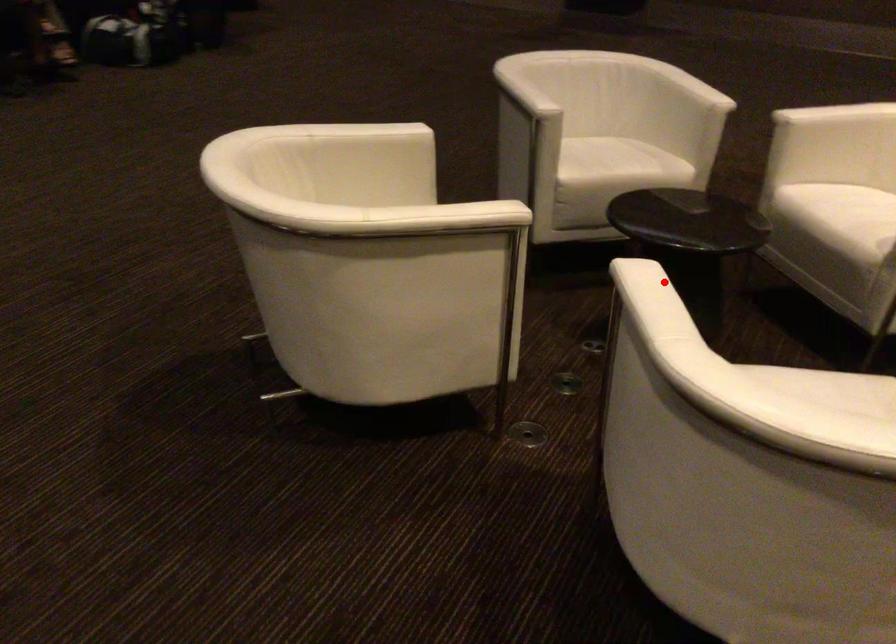
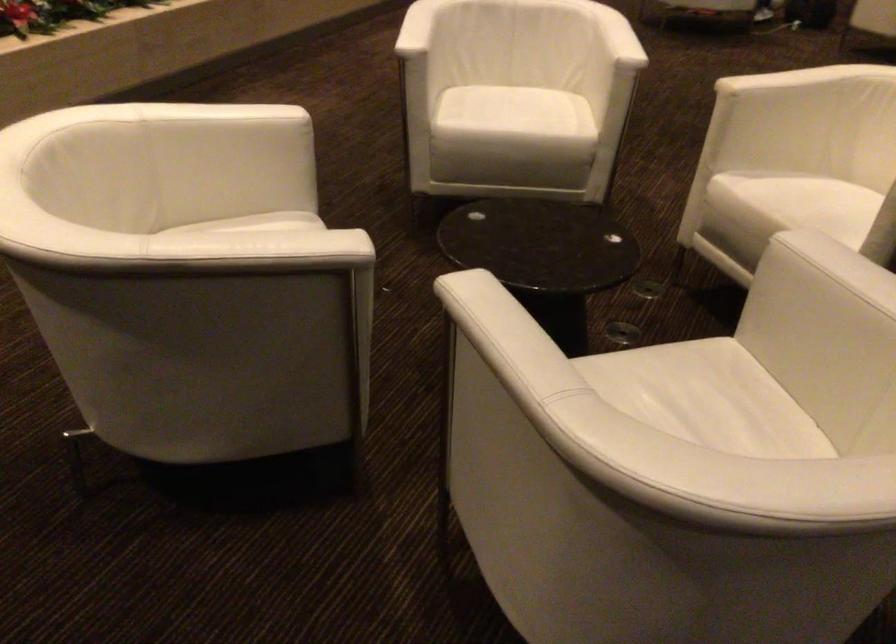
In the second image, find the point that corresponds to the highlighted location in the first image.

(617, 37)